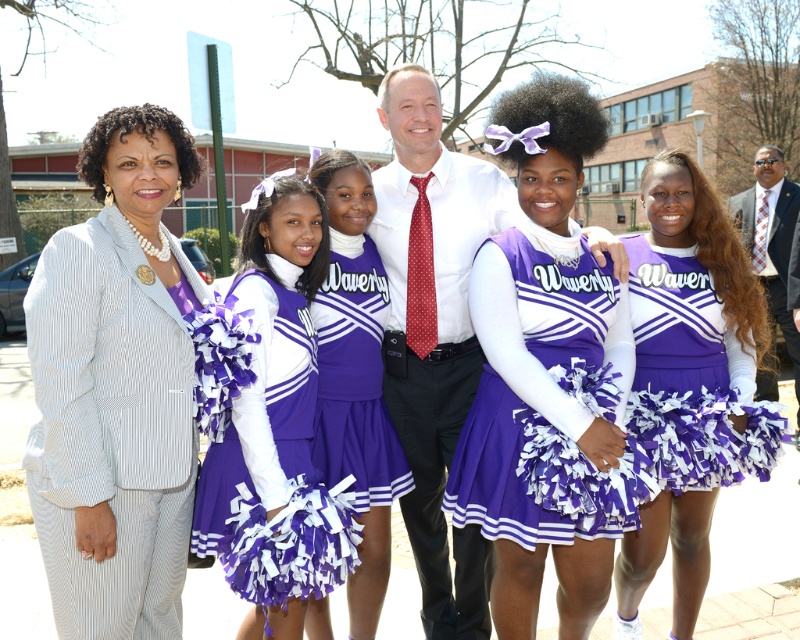
Is point (344, 540) positioned in front of point (746, 276)?

Yes, point (344, 540) is closer to viewer.

Is purple fabric pom-poms at center bigger than purple matte cheerleader at center?

Incorrect, purple fabric pom-poms at center is not larger than purple matte cheerleader at center.

Does point (230, 420) lie in front of point (658, 298)?

Yes, it is in front of point (658, 298).

The image size is (800, 640). I want to click on purple fabric pom-poms at center, so click(268, 419).

I want to click on polished white shirt at center, so click(433, 332).

Between polished white shirt at center and purple satin cheerleading outfit at center, which one has less height?

purple satin cheerleading outfit at center is shorter.

Does point (488, 582) come behind point (498, 436)?

Yes.

The height and width of the screenshot is (640, 800). Identify the location of polished white shirt at center. point(433,332).

Which is behind, point (692, 493) or point (584, 346)?

The point (692, 493) is more distant.

Who is positioned more to the left, purple matte cheerleader at center or purple satin cheerleading outfit at center?

From the viewer's perspective, purple satin cheerleading outfit at center appears more on the left side.

Does point (732, 340) come behind point (516, 422)?

Yes.

In order to click on purple matte cheerleader at center in this screenshot , I will do `click(692, 289)`.